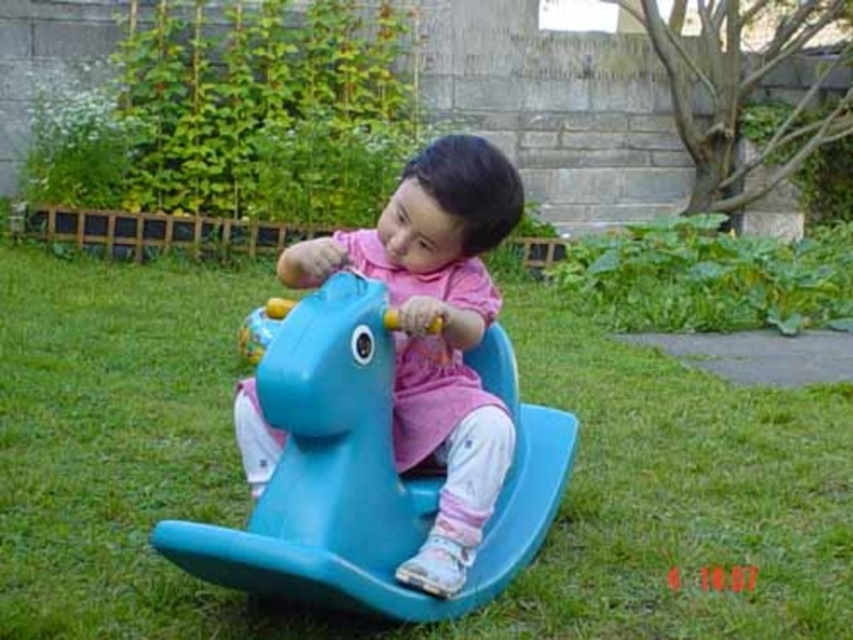
Which of these two, blue plastic horse at center or matte plastic horse at center, stands shorter?

blue plastic horse at center is shorter.

Does blue plastic horse at center have a larger size compared to matte plastic horse at center?

Correct, blue plastic horse at center is larger in size than matte plastic horse at center.

Is point (544, 419) in front of point (424, 339)?

That is False.

Image resolution: width=853 pixels, height=640 pixels. I want to click on blue plastic horse at center, so click(367, 472).